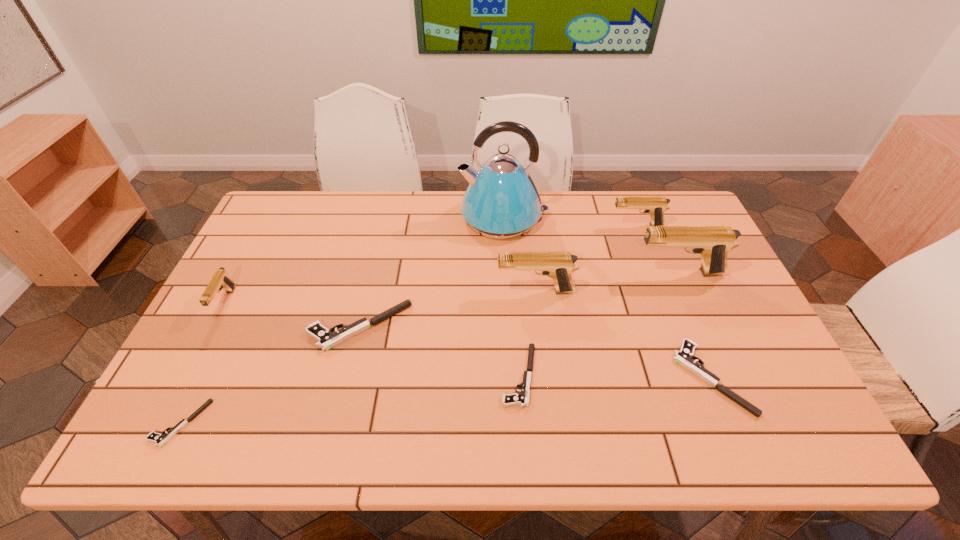
Identify the location of pistol that is at the far edge. click(654, 206).

This screenshot has width=960, height=540. What are the coordinates of `object located at the near left corner` in the screenshot? It's located at (160, 439).

At what (x,y) coordinates should I click in order to perform the action: click on object located in the far right corner section of the desktop. Please return your answer as a coordinate pair (x, y). The image size is (960, 540). Looking at the image, I should click on (654, 206).

Find the location of a particular element. object located at the near right corner is located at coordinates (684, 357).

The width and height of the screenshot is (960, 540). In the image, there is a desktop. Find the location of `free region at the far edge`. free region at the far edge is located at coordinates (401, 210).

Locate an element on the screen. The image size is (960, 540). free space at the near edge is located at coordinates (603, 442).

Where is `vacant position at the left edge of the desktop`? This screenshot has height=540, width=960. vacant position at the left edge of the desktop is located at coordinates (284, 243).

You are a GUI agent. You are given a task and a screenshot of the screen. Output one action in this format:
    pyautogui.click(x=<x>, y=<y>)
    Task: Click on the free space at the right edge of the desktop
    The height and width of the screenshot is (540, 960).
    Given the screenshot: What is the action you would take?
    pyautogui.click(x=686, y=253)

Where is `vacant space at the far left corner`? Image resolution: width=960 pixels, height=540 pixels. vacant space at the far left corner is located at coordinates (284, 230).

In the image, there is a desktop. Where is `vacant space at the far right corner`? The width and height of the screenshot is (960, 540). vacant space at the far right corner is located at coordinates (684, 220).